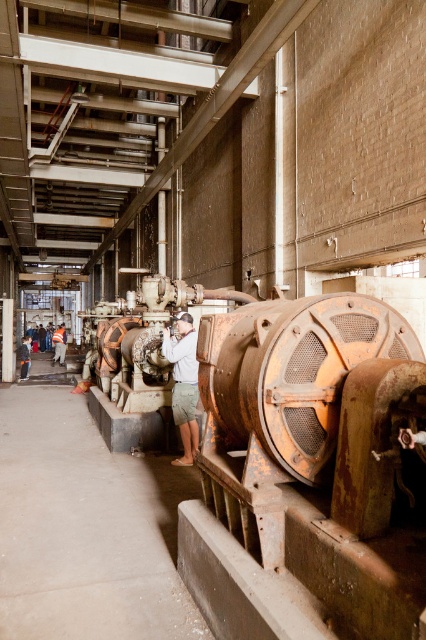
You are a safety inspector in the power plant. You notice an orange reflective vest at center and a camera. How far apart are these two items?

The orange reflective vest at center and the camera are 19.77 meters apart.

You are an inspector in this industrial setting. You notice an orange reflective vest at center and a light brown leather jacket at lower left. Which item is positioned higher up in the scene?

The orange reflective vest at center is much taller than the light brown leather jacket at lower left, so it is positioned higher up in the scene.

You are a maintenance worker needing to reach the light brown leather jacket at lower left from your current position near the light brown fabric shorts at center. Given that your tool kit weighs 20 pounds and you can carry it for up to 40 feet before needing a rest, can you make the trip without needing to stop?

The distance between the light brown fabric shorts at center and the light brown leather jacket at lower left is 35.61 feet, which is within your 40 feet carrying capacity. Therefore, you can reach the light brown leather jacket at lower left without needing to stop for a rest.